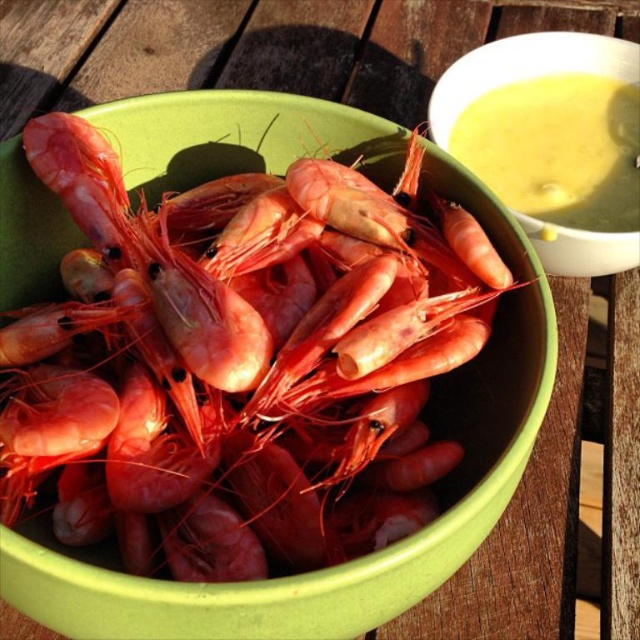
Does point (10, 408) come in front of point (630, 131)?

That is True.

Between glossy pink shrimp at center and yellow creamy soup at upper right, which one is positioned higher?

yellow creamy soup at upper right is above.

Which is behind, point (109, 496) or point (624, 108)?

The point (624, 108) is more distant.

The image size is (640, 640). Find the location of `glossy pink shrimp at center`. glossy pink shrimp at center is located at coordinates (237, 330).